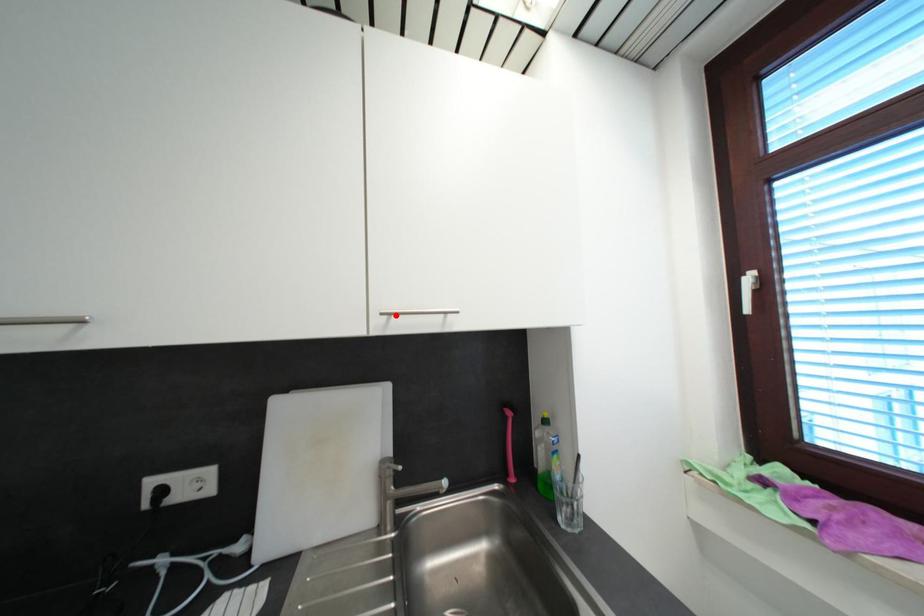
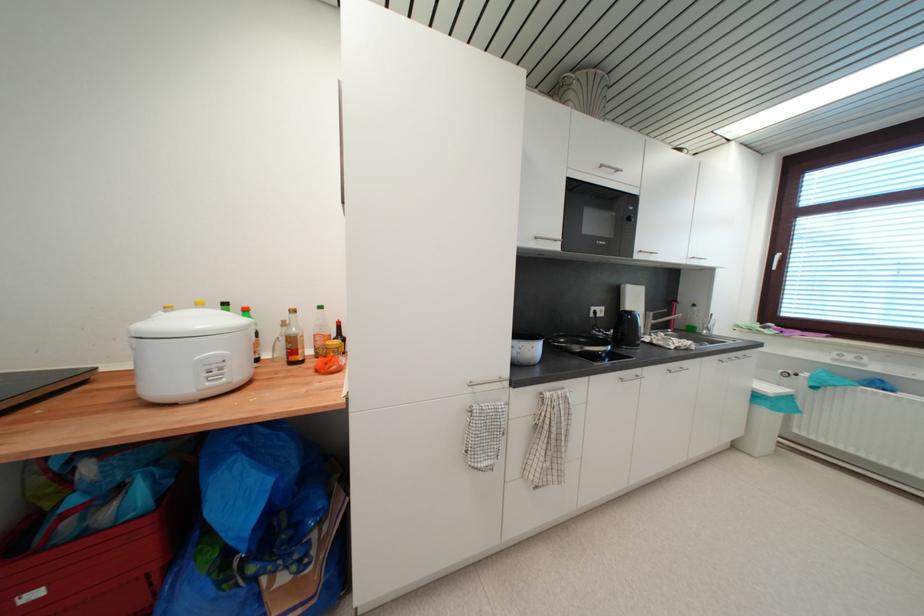
In the second image, find the point that corresponds to the highlighted location in the first image.

(697, 261)